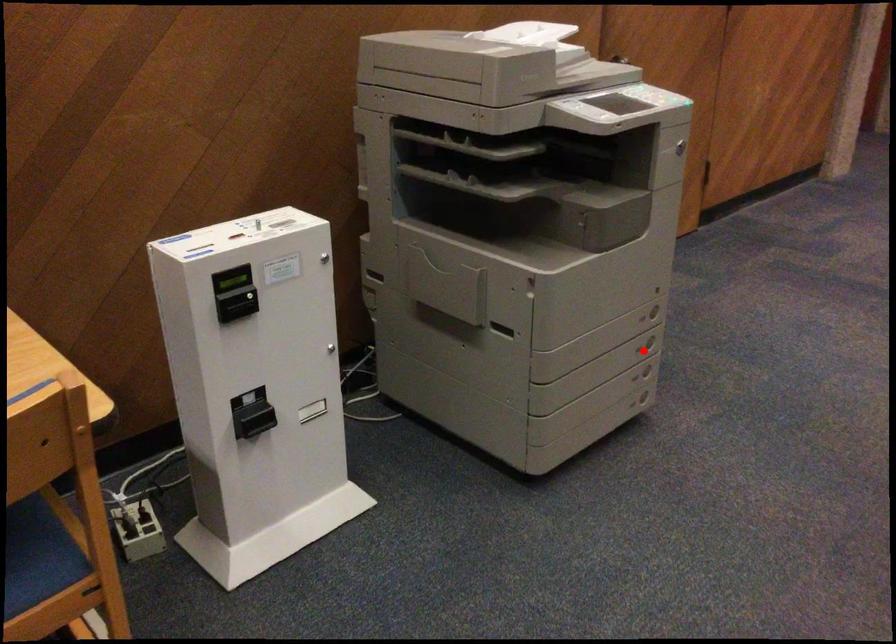
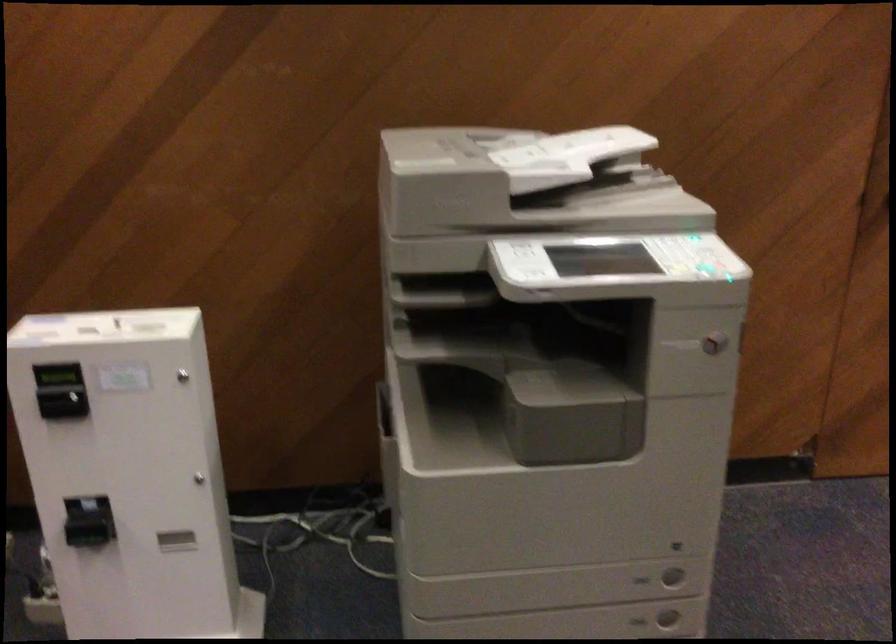
Find the pixel in the second image that matches the highlighted location in the first image.

(638, 621)